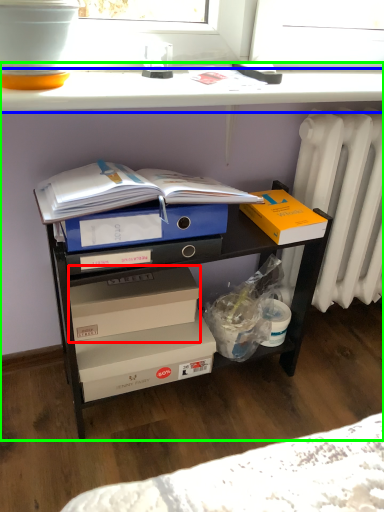
Question: Which is nearer to the box (highlighted by a red box)? window sill (highlighted by a blue box) or desk (highlighted by a green box).

Choices:
 (A) window sill
 (B) desk

Answer: (B)